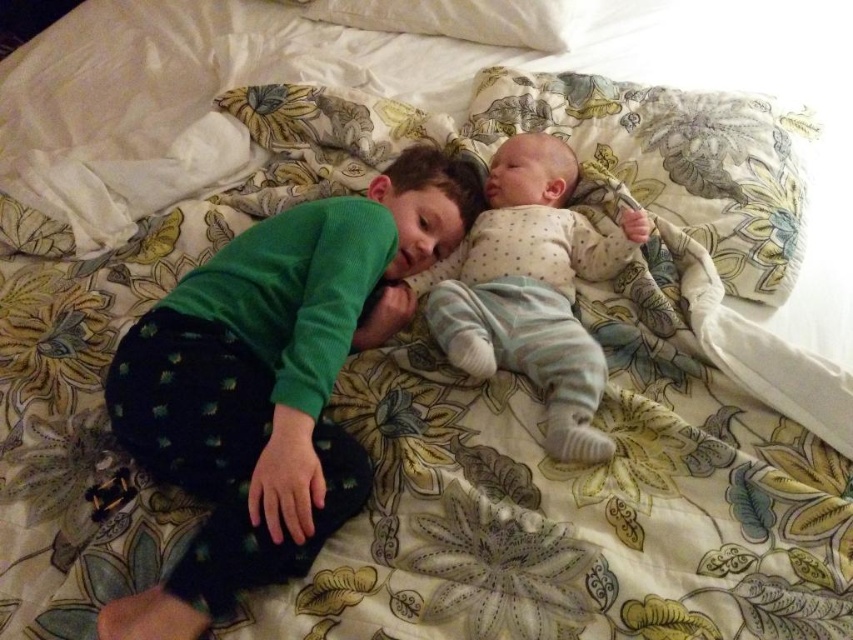
You are a parent trying to decide whether to place the fluffy fabric pillow at upper center on top of the light blue cotton onesie at center to keep it in place. Based on their sizes, will the pillow completely cover the onesie?

The fluffy fabric pillow at upper center is larger in size than the light blue cotton onesie at center, so placing the pillow on top would completely cover the onesie.

You are a photographer trying to capture a closeup of the light blue cotton onesie at center while ensuring the toddler on the left and the floral blanket are still visible in the frame. Based on the coordinates provided in the description, where should you position your camera relative to the bed?

The light blue cotton onesie at center is located at point [532,289], so you should position your camera slightly to the right and lower down to focus on the onesie while keeping the toddler and the floral blanket in view.

You are a parent trying to place a light blue cotton onesie at center on a fluffy fabric pillow at upper center. Can the onesie fit on the pillow without hanging off the edges?

The fluffy fabric pillow at upper center is wider than the light blue cotton onesie at center, so the onesie can fit on the pillow without hanging off the edges.